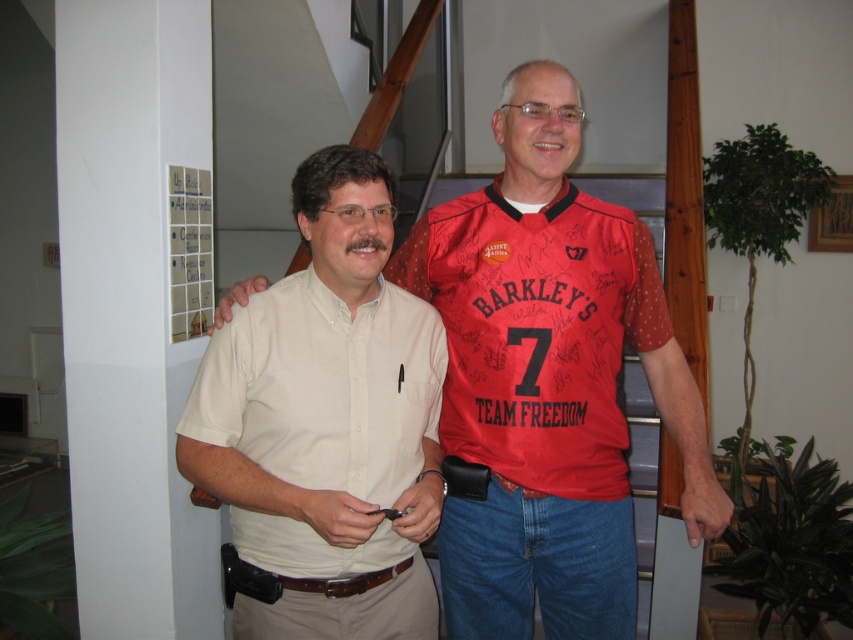
You are a photographer standing 5 feet away from the camera. You want to take a closeup shot of the matte white shirt at center. Can you reach the shirt without moving your feet?

The matte white shirt at center is 4.45 feet away from the camera. Since you are standing 5 feet away from the camera, you are 0.55 feet farther than the shirt. Therefore, you cannot reach it without moving closer.

You are a photographer trying to capture both the beige cotton shirt at center and the matte white shirt at center in a single frame. Which shirt should you focus on first to ensure both are in the frame?

The beige cotton shirt at center is smaller than the matte white shirt at center, so you should focus on the matte white shirt at center first to ensure both are in the frame.